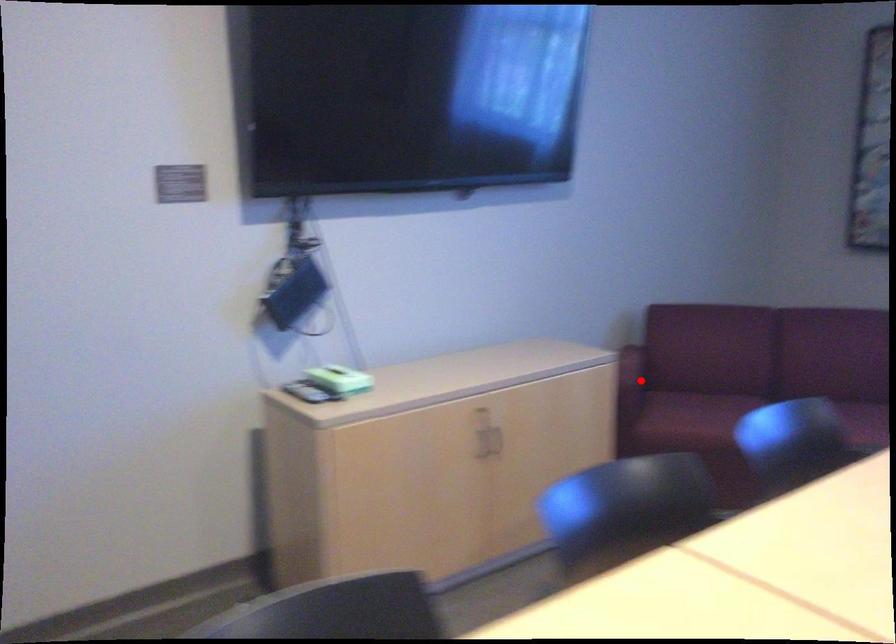
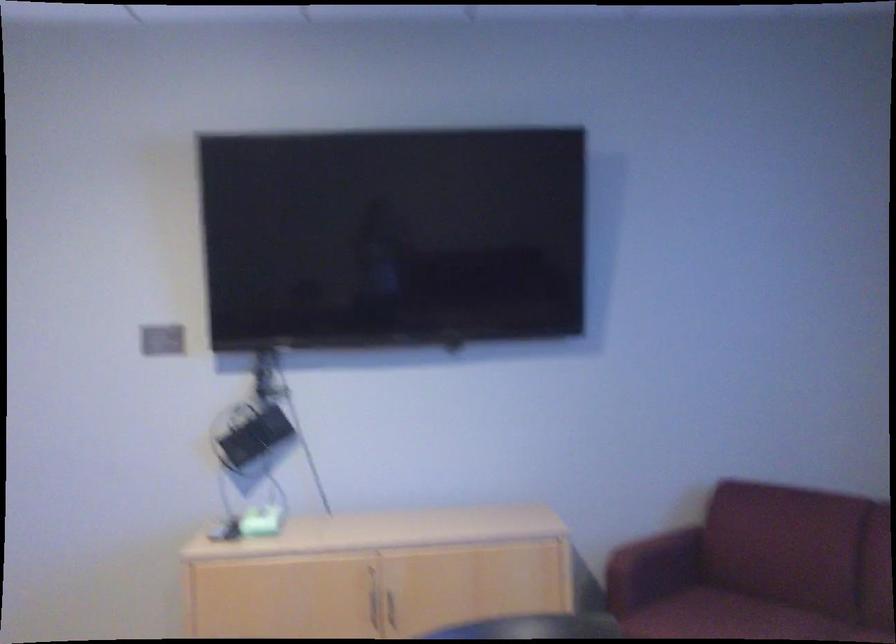
Question: A red point is marked in image1. In image2, is the corresponding 3D point closer to the camera or farther? Reply with the corresponding letter.

Choices:
 (A) The corresponding 3D point is closer.
 (B) The corresponding 3D point is farther.

Answer: (A)